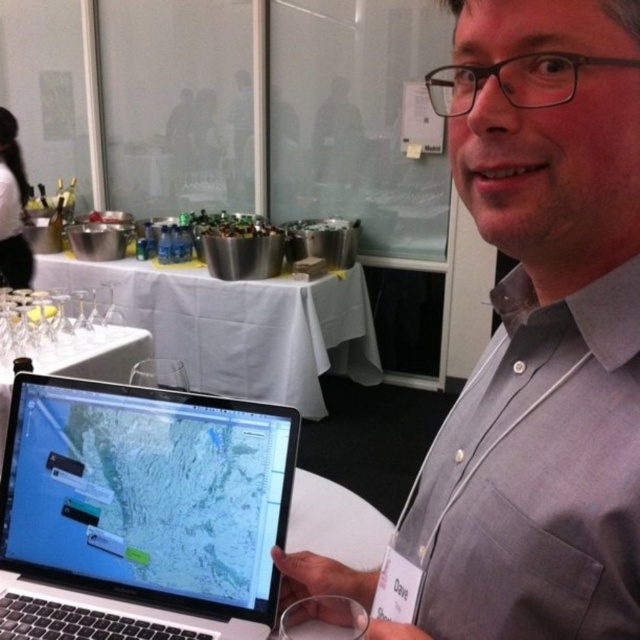
You are a photographer trying to capture the man in the scene without including the table in the background. Based on their positions, can you position yourself in a way that the gray cotton shirt at center is visible but the white cloth table at center is not?

The gray cotton shirt at center is in front of the white cloth table at center, so if you position yourself so that the shirt blocks the view of the table, you can capture the shirt without the table in the background.